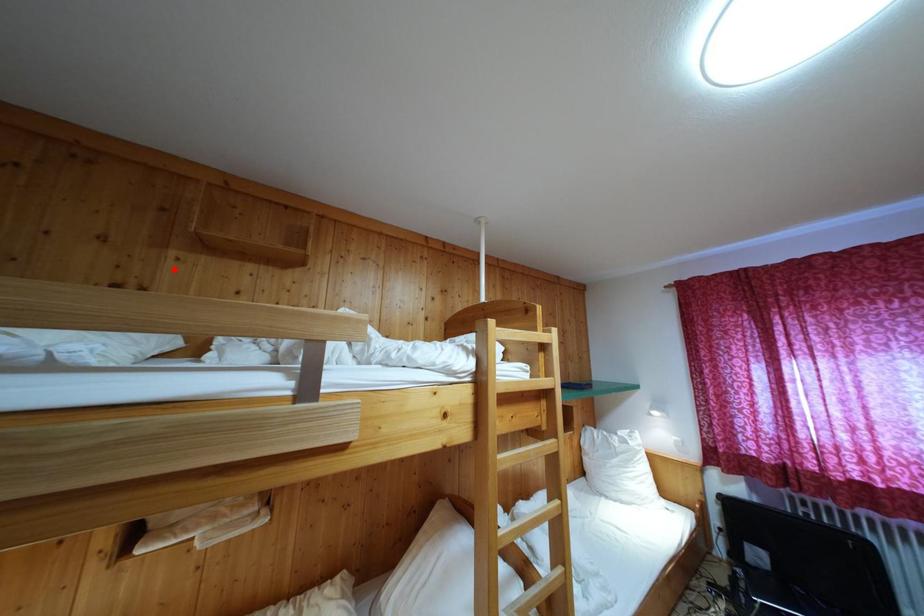
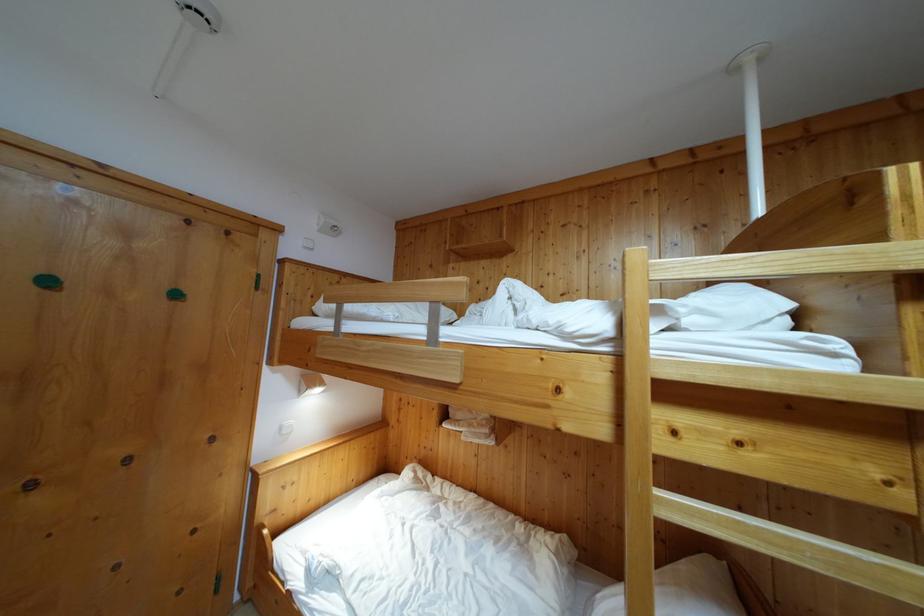
Find the pixel in the second image that matches the highlighted location in the first image.

(455, 278)